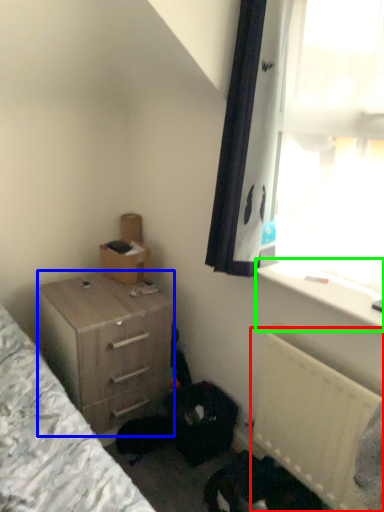
Question: Which object is positioned farthest from radiator (highlighted by a red box)? Select from chest of drawers (highlighted by a blue box) and window sill (highlighted by a green box).

Choices:
 (A) chest of drawers
 (B) window sill

Answer: (A)